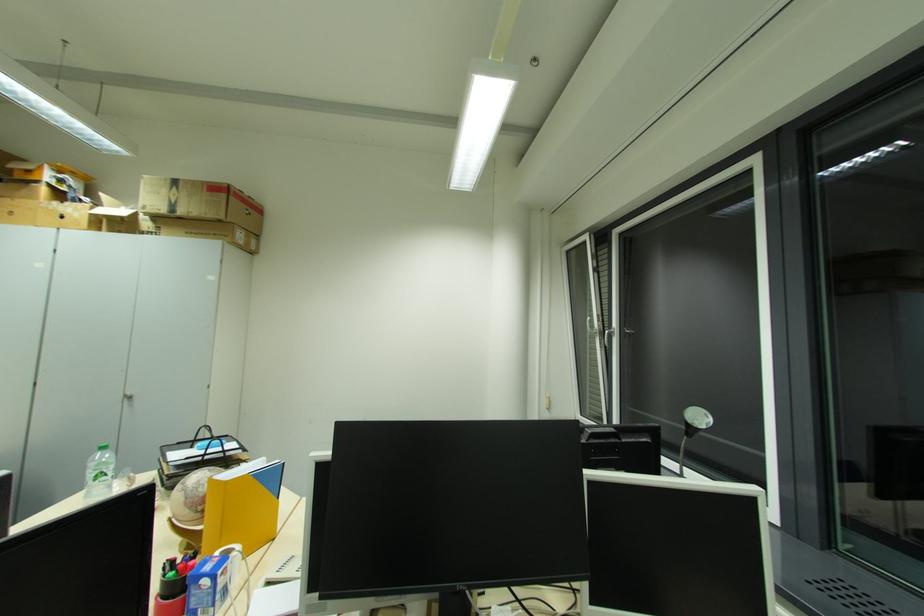
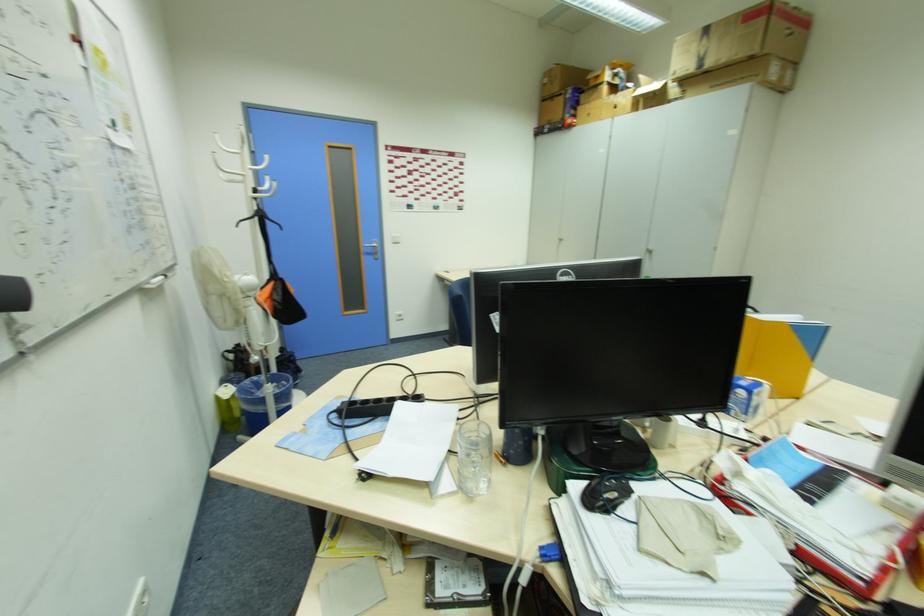
First-person continuous shooting, in which direction is the camera rotating?

The camera's rotation is toward left-down.